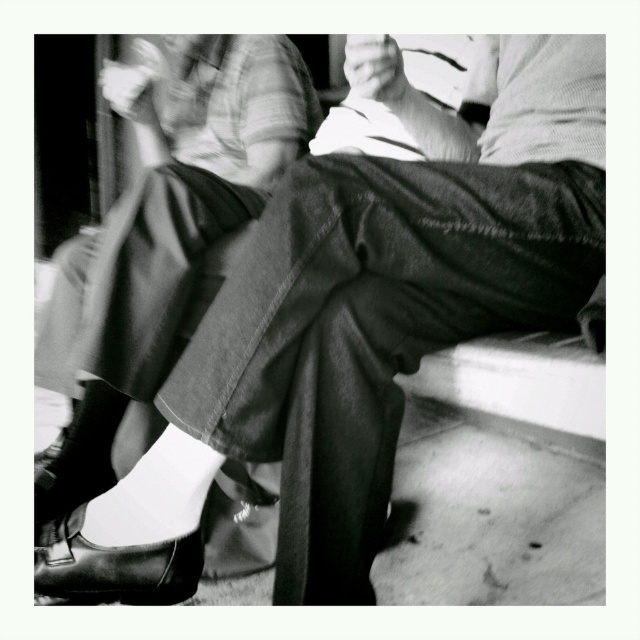
Question: Does shiny leather shoe at lower left appear under leather shoe at lower left?

Choices:
 (A) yes
 (B) no

Answer: (A)

Question: Does shiny leather shoe at lower left have a lesser width compared to leather shoe at lower left?

Choices:
 (A) no
 (B) yes

Answer: (A)

Question: Which point is farther to the camera?

Choices:
 (A) shiny leather shoe at lower left
 (B) denim pants at center
 (C) leather shoe at lower left

Answer: (C)

Question: Estimate the real-world distances between objects in this image. Which object is closer to the leather shoe at lower left?

Choices:
 (A) denim pants at center
 (B) shiny leather shoe at lower left

Answer: (B)

Question: Does denim pants at center have a larger size compared to shiny leather shoe at lower left?

Choices:
 (A) no
 (B) yes

Answer: (B)

Question: Which point is closer to the camera taking this photo?

Choices:
 (A) (83, 448)
 (B) (77, 568)

Answer: (B)